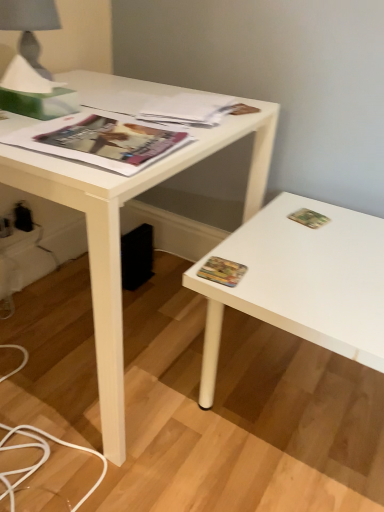
Question: Can you confirm if multicolored paper at right, arranged as the first paperback book when ordered from the bottom, is shorter than black plastic electric outlet at lower left, which ranks as the 1th electric outlet in back-to-front order?

Choices:
 (A) yes
 (B) no

Answer: (A)

Question: From a real-world perspective, is multicolored paper at right, which appears as the second paperback book when viewed from the right, below black plastic electric outlet at lower left, which ranks as the 1th electric outlet in back-to-front order?

Choices:
 (A) no
 (B) yes

Answer: (A)

Question: Considering the relative sizes of multicolored paper at right, which ranks as the 2th paperback book in top-to-bottom order, and black plastic electric outlet at lower left, which ranks as the 1th electric outlet in back-to-front order, in the image provided, is multicolored paper at right, which ranks as the 2th paperback book in top-to-bottom order, smaller than black plastic electric outlet at lower left, which ranks as the 1th electric outlet in back-to-front order,?

Choices:
 (A) no
 (B) yes

Answer: (B)

Question: From the image's perspective, is multicolored paper at right, arranged as the first paperback book when ordered from the bottom, above black plastic electric outlet at lower left, the 2th electric outlet viewed from the front?

Choices:
 (A) no
 (B) yes

Answer: (A)

Question: Is multicolored paper at right, arranged as the first paperback book when ordered from the bottom, at the left side of black plastic electric outlet at lower left, the 2th electric outlet viewed from the front?

Choices:
 (A) no
 (B) yes

Answer: (A)

Question: From a real-world perspective, is multicolored paper at right, the 1th paperback book when ordered from left to right, on black plastic electric outlet at lower left, the 2th electric outlet viewed from the front?

Choices:
 (A) yes
 (B) no

Answer: (A)

Question: Is the depth of white matte desk at center greater than that of matte paper magazine at upper center, the 1th magazine viewed from the back?

Choices:
 (A) no
 (B) yes

Answer: (A)

Question: Is white matte desk at center surrounding matte paper magazine at upper center, the 1th magazine viewed from the back?

Choices:
 (A) no
 (B) yes

Answer: (A)

Question: Is white matte desk at center wider than matte paper magazine at upper center, the second magazine from the front?

Choices:
 (A) yes
 (B) no

Answer: (A)

Question: From the image's perspective, would you say white matte desk at center is positioned over matte paper magazine at upper center, the 1th magazine viewed from the back?

Choices:
 (A) yes
 (B) no

Answer: (B)

Question: From the image's perspective, is white matte desk at center located beneath matte paper magazine at upper center, the 1th magazine viewed from the back?

Choices:
 (A) no
 (B) yes

Answer: (B)

Question: Can you confirm if white matte desk at center is thinner than matte paper magazine at upper center, the 1th magazine viewed from the back?

Choices:
 (A) yes
 (B) no

Answer: (B)

Question: Is the depth of matte paper magazine at upper left, positioned as the first magazine in front-to-back order, less than that of multicolored paper at right, arranged as the first paperback book when ordered from the bottom?

Choices:
 (A) yes
 (B) no

Answer: (A)